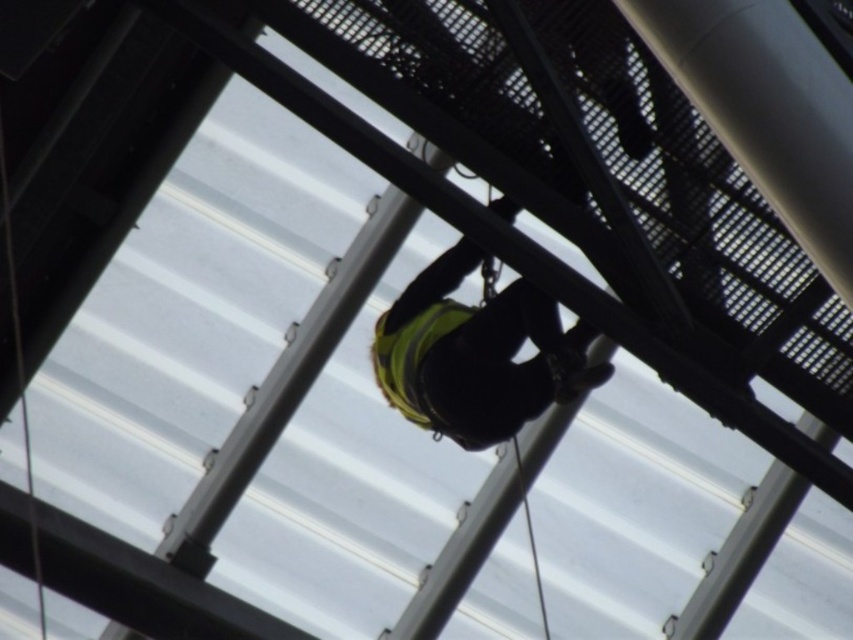
Can you confirm if yellow reflective vest at center is bigger than yellow reflective safety vest at center?

Yes, yellow reflective vest at center is bigger than yellow reflective safety vest at center.

Can you confirm if yellow reflective vest at center is positioned to the left of yellow reflective safety vest at center?

Incorrect, yellow reflective vest at center is not on the left side of yellow reflective safety vest at center.

Measure the distance between point (474, 410) and camera.

A distance of 26.24 feet exists between point (474, 410) and camera.

This screenshot has width=853, height=640. Find the location of `yellow reflective vest at center`. yellow reflective vest at center is located at coordinates (477, 355).